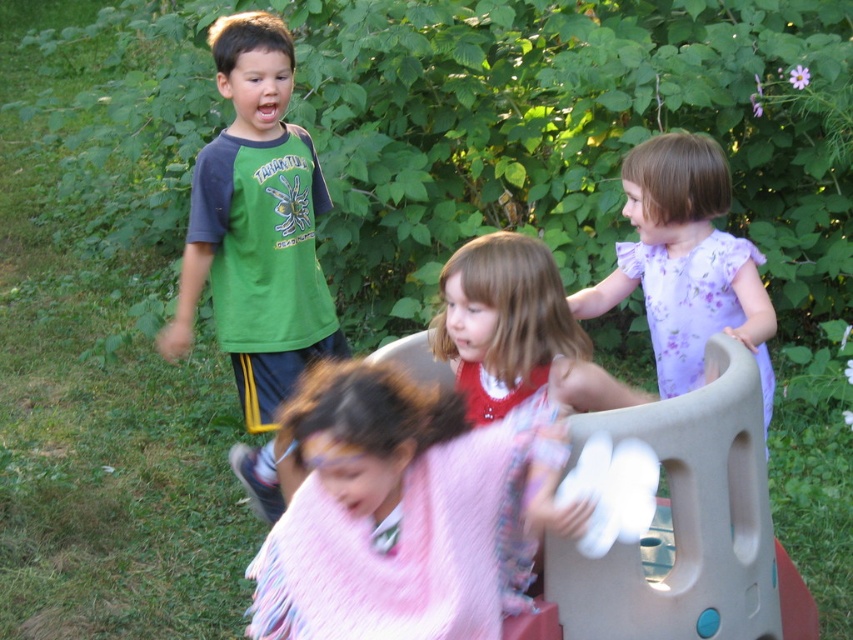
Question: Can you confirm if fuzzy pink blanket at center is positioned above purple floral dress at upper right?

Choices:
 (A) no
 (B) yes

Answer: (A)

Question: Which object appears farthest from the camera in this image?

Choices:
 (A) green raglan shirt at upper left
 (B) fuzzy pink blanket at center
 (C) purple floral dress at upper right

Answer: (A)

Question: Which of the following is the farthest from the observer?

Choices:
 (A) purple floral dress at upper right
 (B) fuzzy pink blanket at center

Answer: (A)

Question: Which object is positioned farthest from the purple floral dress at upper right?

Choices:
 (A) fuzzy pink blanket at center
 (B) green raglan shirt at upper left

Answer: (B)

Question: Does fuzzy pink blanket at center appear on the left side of purple floral dress at upper right?

Choices:
 (A) yes
 (B) no

Answer: (A)

Question: Does fuzzy pink blanket at center appear on the right side of purple floral dress at upper right?

Choices:
 (A) yes
 (B) no

Answer: (B)